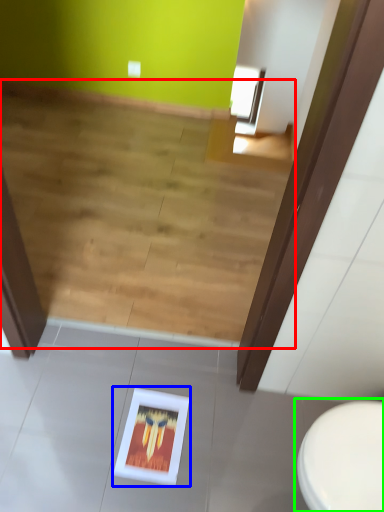
Question: Which object is the closest to the stairwell (highlighted by a red box)? Choose among these: picture frame (highlighted by a blue box) or toilet (highlighted by a green box).

Choices:
 (A) picture frame
 (B) toilet

Answer: (A)